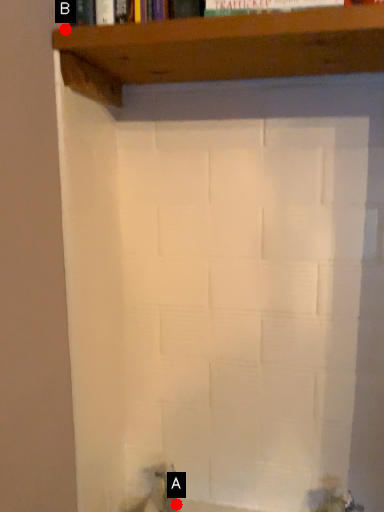
Question: Two points are circled on the image, labeled by A and B beside each circle. Which point is farther to the camera?

Choices:
 (A) A is further
 (B) B is further

Answer: (A)